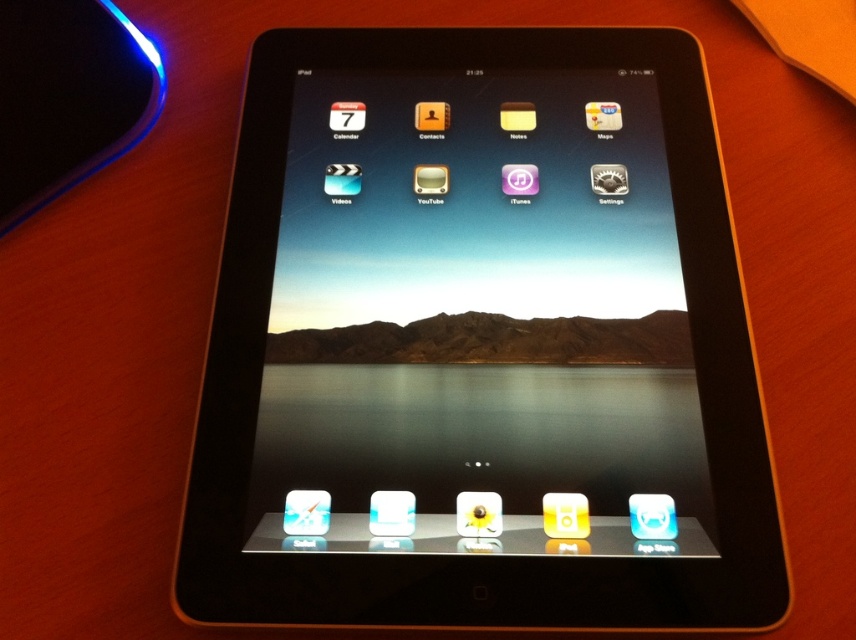
Question: Which point is closer to the camera?

Choices:
 (A) (489, 529)
 (B) (554, 308)

Answer: (A)

Question: From the image, what is the correct spatial relationship of black glossy tablet at center in relation to matte white ipod at center?

Choices:
 (A) left
 (B) right

Answer: (B)

Question: Does black glossy tablet at center appear on the right side of matte white ipod at center?

Choices:
 (A) yes
 (B) no

Answer: (A)

Question: Observing the image, what is the correct spatial positioning of black glossy tablet at center in reference to matte white ipod at center?

Choices:
 (A) above
 (B) below

Answer: (A)